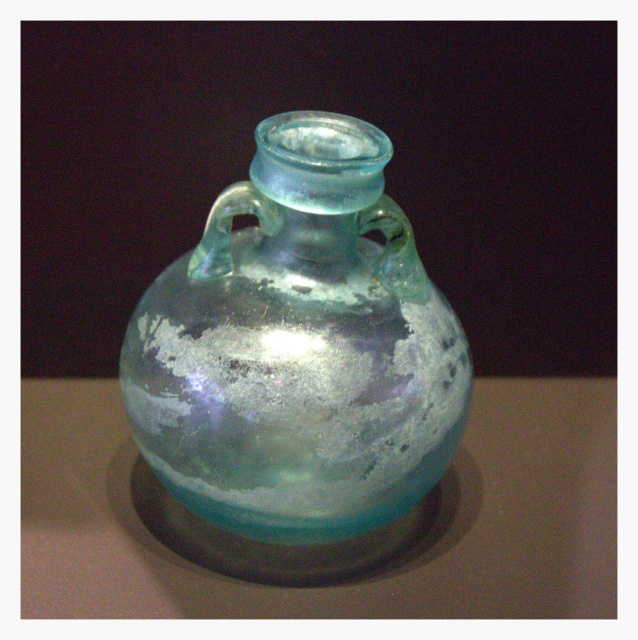
You are an archaeologist examining a glass vessel. You notice a point at coordinates (299, 348). What object is located at that point?

The translucent glass vase at center is located at point (299, 348).

You are an archaeologist examining two translucent glass objects in a dark room. You see the translucent glass vase at center and the translucent glass jar at center. Which object is nearer to you?

The translucent glass vase at center is closer to the viewer than the translucent glass jar at center.

You are a photographer trying to capture the translucent glass vase at center. If your camera is set to focus at 40 inches, will the vase be in focus?

The distance between the translucent glass vase at center and the camera is 38.47 inches, which is less than 40 inches. Therefore, the vase will not be in focus since the camera is focused further away than the vase is located.